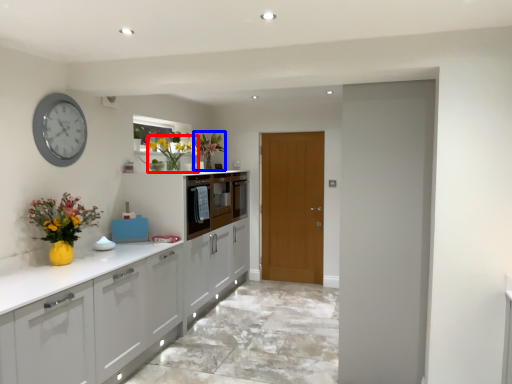
Question: Which point is closer to the camera, floral arrangement (highlighted by a red box) or floral arrangement (highlighted by a blue box)?

Choices:
 (A) floral arrangement
 (B) floral arrangement

Answer: (A)